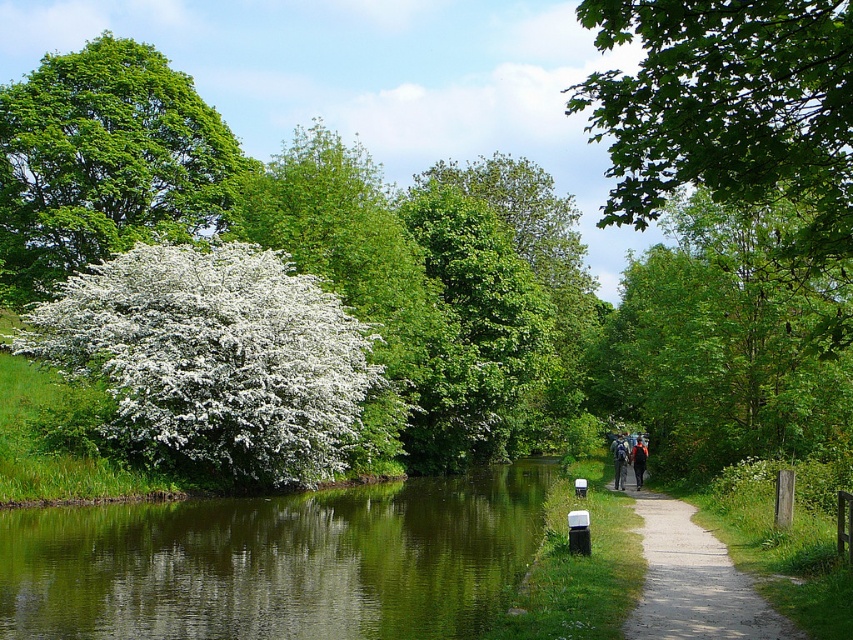
Does green leafy tree at upper right have a lesser height compared to green fabric backpack at center-right?

No.

Is green leafy tree at upper right below green fabric backpack at center-right?

No, green leafy tree at upper right is not below green fabric backpack at center-right.

At what (x,y) coordinates should I click in order to perform the action: click on green leafy tree at upper right. Please return your answer as a coordinate pair (x, y). The image size is (853, 640). Looking at the image, I should click on (727, 108).

In order to click on green leafy tree at upper right in this screenshot , I will do click(x=727, y=108).

Which is more to the left, white fluffy bush at left or green leafy tree at upper left?

Positioned to the left is green leafy tree at upper left.

Does white fluffy bush at left lie in front of green leafy tree at upper left?

That is True.

Image resolution: width=853 pixels, height=640 pixels. What do you see at coordinates (213, 358) in the screenshot?
I see `white fluffy bush at left` at bounding box center [213, 358].

At what (x,y) coordinates should I click in order to perform the action: click on white fluffy bush at left. Please return your answer as a coordinate pair (x, y). This screenshot has width=853, height=640. Looking at the image, I should click on (213, 358).

Can you confirm if white fluffy bush at left is positioned above dark blue backpack at center-right?

Yes, white fluffy bush at left is above dark blue backpack at center-right.

Does white fluffy bush at left appear under dark blue backpack at center-right?

No.

You are a GUI agent. You are given a task and a screenshot of the screen. Output one action in this format:
    pyautogui.click(x=<x>, y=<y>)
    Task: Click on the white fluffy bush at left
    
    Given the screenshot: What is the action you would take?
    pyautogui.click(x=213, y=358)

Where is `white fluffy bush at left`? This screenshot has width=853, height=640. white fluffy bush at left is located at coordinates (213, 358).